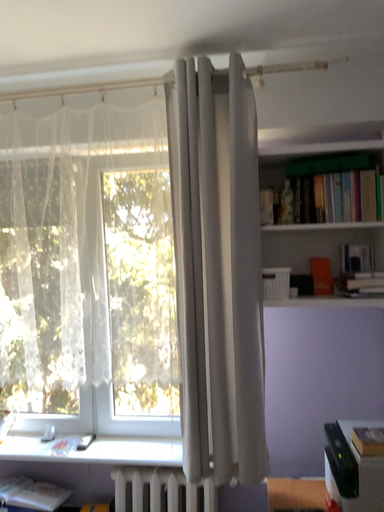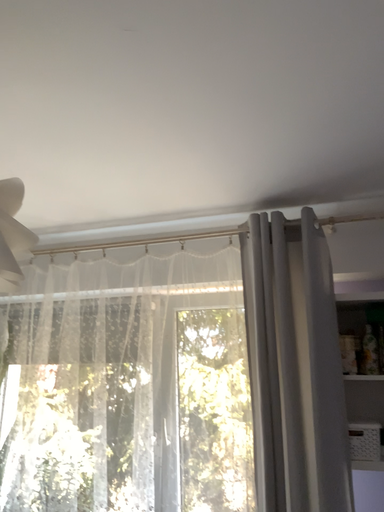
Question: How did the camera likely rotate when shooting the video?

Choices:
 (A) rotated upward
 (B) rotated downward

Answer: (A)